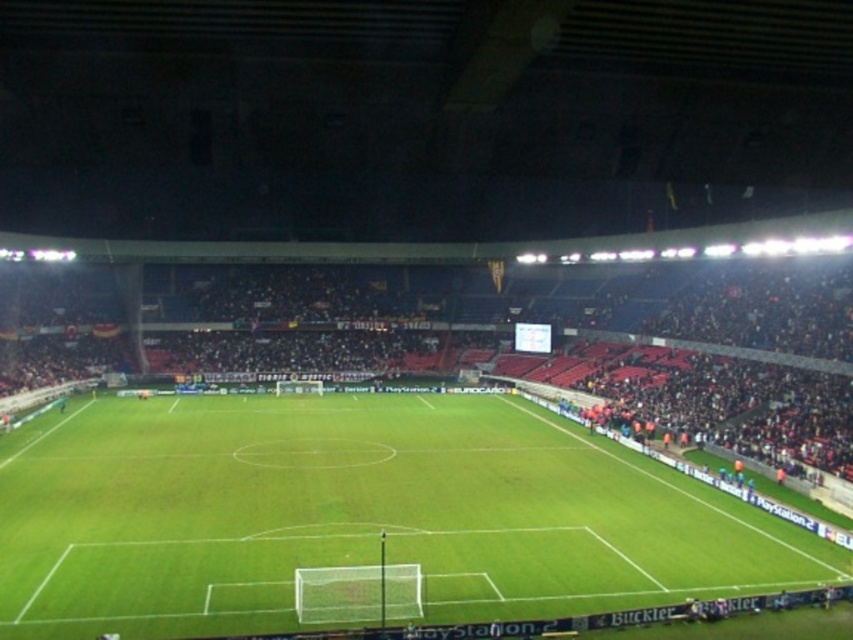
Question: Observing the image, what is the correct spatial positioning of green grass football field at center in reference to dark red seats at center?

Choices:
 (A) left
 (B) right

Answer: (A)

Question: Does green grass football field at center have a smaller size compared to dark red seats at center?

Choices:
 (A) no
 (B) yes

Answer: (B)

Question: Which object appears closest to the camera in this image?

Choices:
 (A) dark red seats at center
 (B) green grass football field at center

Answer: (B)

Question: Can you confirm if green grass football field at center is wider than dark red seats at center?

Choices:
 (A) no
 (B) yes

Answer: (A)